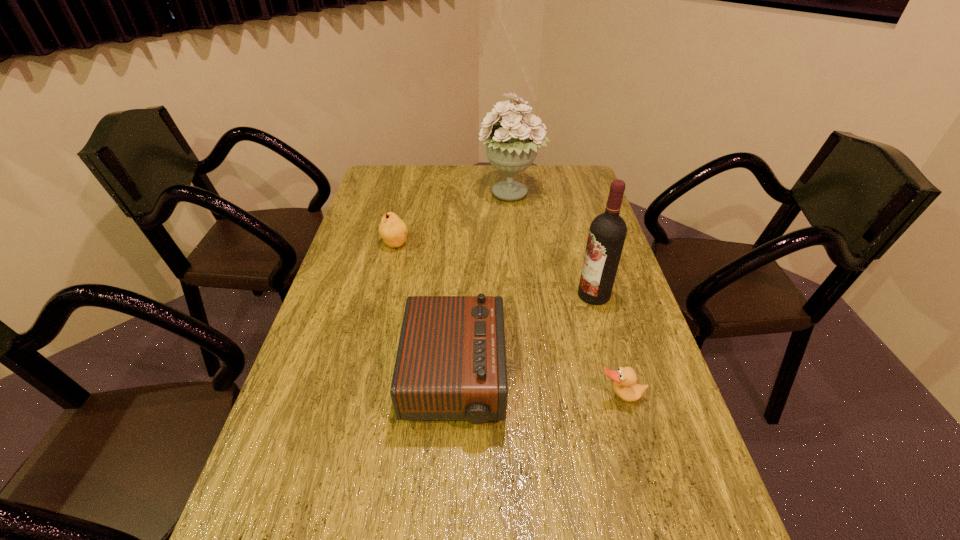
Where is `free region located 0.280m on the front panel of the third shortest object`? The image size is (960, 540). free region located 0.280m on the front panel of the third shortest object is located at coordinates click(x=623, y=379).

At what (x,y) coordinates should I click in order to perform the action: click on vacant region located on the front of the second farthest object. Please return your answer as a coordinate pair (x, y). The width and height of the screenshot is (960, 540). Looking at the image, I should click on pyautogui.click(x=377, y=317).

You are a GUI agent. You are given a task and a screenshot of the screen. Output one action in this format:
    pyautogui.click(x=<x>, y=<y>)
    Task: Click on the free space located 0.190m on the beak of the shortest object
    
    Given the screenshot: What is the action you would take?
    pyautogui.click(x=648, y=493)

This screenshot has height=540, width=960. In order to click on object that is positioned at the far edge in this screenshot , I will do (511, 147).

I want to click on object that is at the left edge, so click(393, 230).

Where is `wine bottle located in the right edge section of the desktop`? The image size is (960, 540). wine bottle located in the right edge section of the desktop is located at coordinates tap(607, 233).

Locate an element on the screen. The image size is (960, 540). duck that is at the right edge is located at coordinates (625, 386).

In the image, there is a desktop. Where is `free region at the far edge`? Image resolution: width=960 pixels, height=540 pixels. free region at the far edge is located at coordinates (548, 183).

The image size is (960, 540). In the image, there is a desktop. What are the coordinates of `free space at the left edge` in the screenshot? It's located at click(x=305, y=416).

In the image, there is a desktop. In order to click on free space at the right edge in this screenshot , I will do `click(602, 345)`.